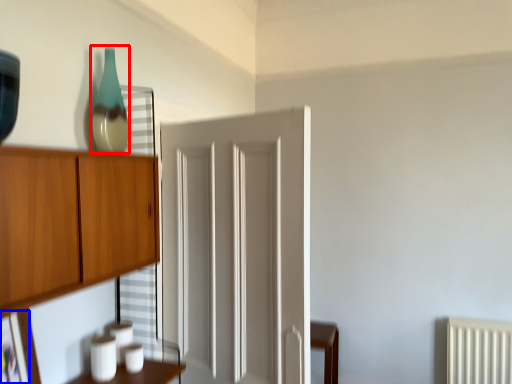
Question: Which point is further to the camera, glass vase (highlighted by a red box) or picture frame (highlighted by a blue box)?

Choices:
 (A) glass vase
 (B) picture frame

Answer: (A)